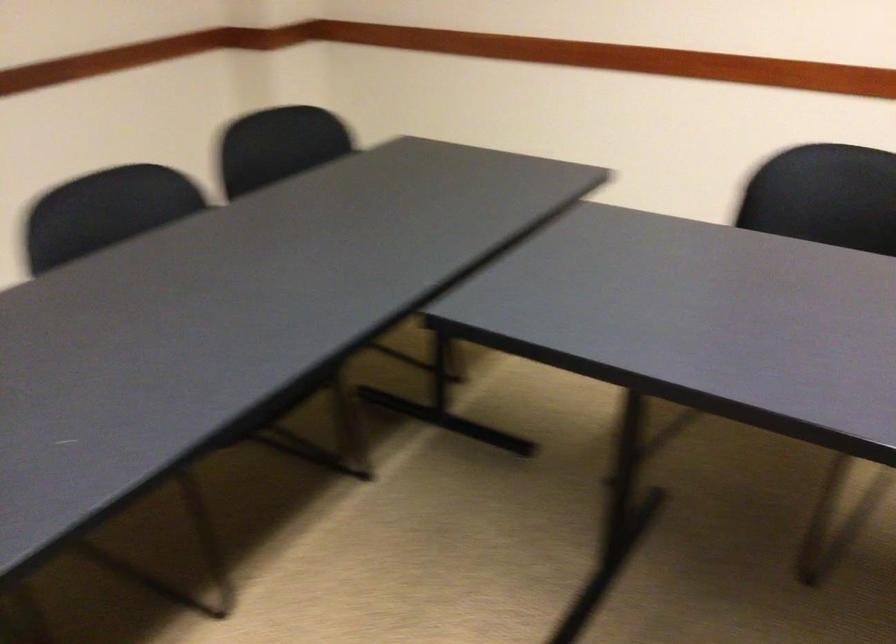
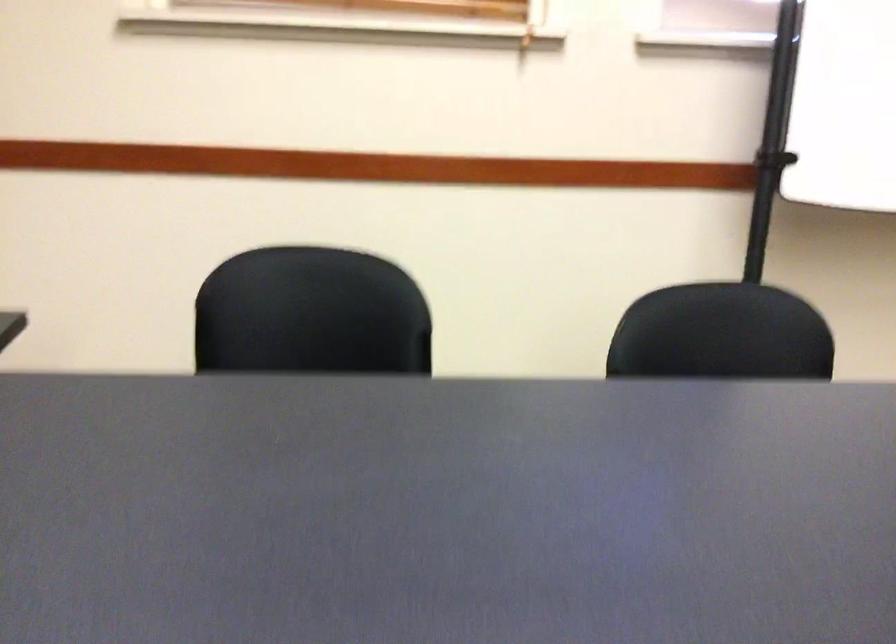
Question: The camera is either moving clockwise (left) or counter-clockwise (right) around the object. The first image is from the beginning of the video and the second image is from the end. Is the camera moving left or right when shooting the video?

Choices:
 (A) Left
 (B) Right

Answer: (A)